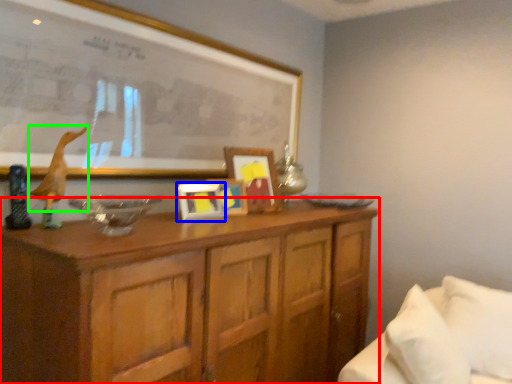
Question: Estimate the real-world distances between objects in this image. Which object is farther from cabinetry (highlighted by a red box), picture frame (highlighted by a blue box) or animal (highlighted by a green box)?

Choices:
 (A) picture frame
 (B) animal

Answer: (B)